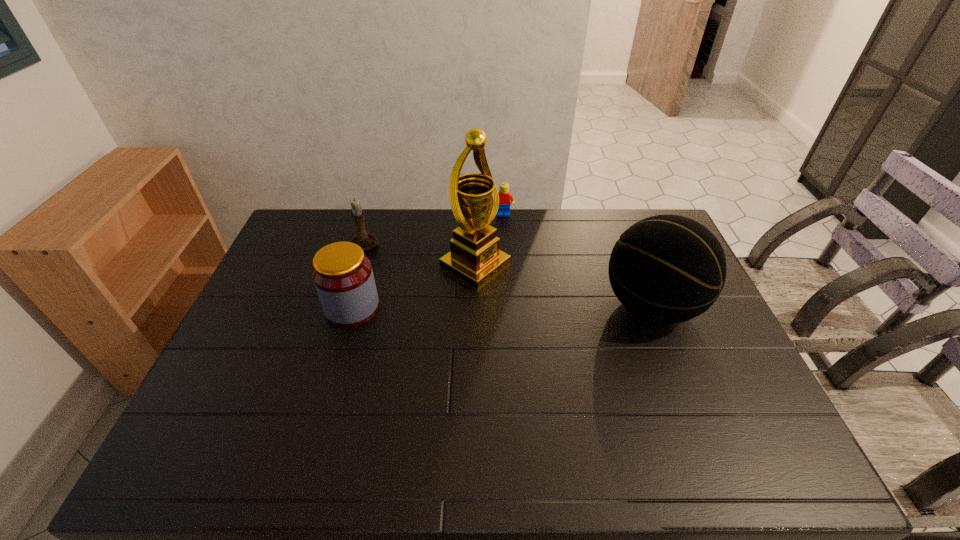
What are the coordinates of `free spot on the desktop that is between the jar and the second tallest object and is positioned on the side of the candle holder with the handle` in the screenshot? It's located at (459, 308).

Locate an element on the screen. The width and height of the screenshot is (960, 540). free space on the desktop that is between the jar and the fourth shortest object and is positioned on the front-facing side of the award is located at coordinates (545, 307).

I want to click on vacant space on the desktop that is between the jar and the rightmost object and is positioned on the face of the shortest object, so click(x=513, y=307).